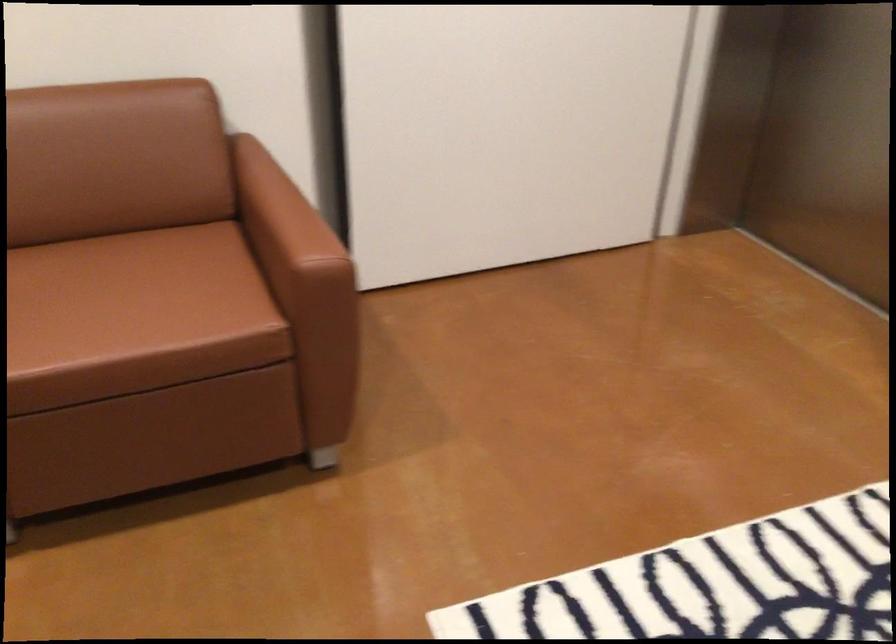
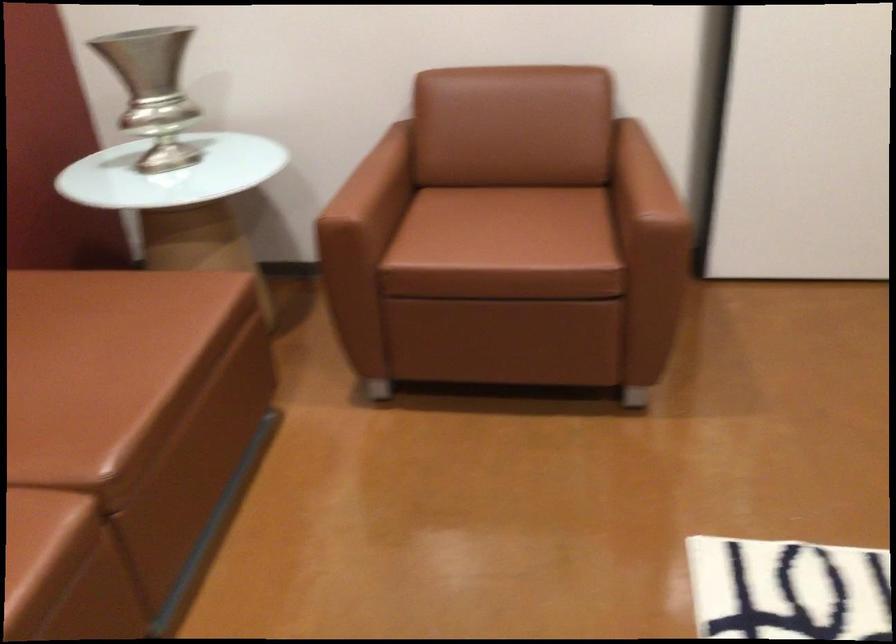
In a continuous first-person perspective shot, in which direction is the camera moving?

The movement direction of the cameraman is right, backward.